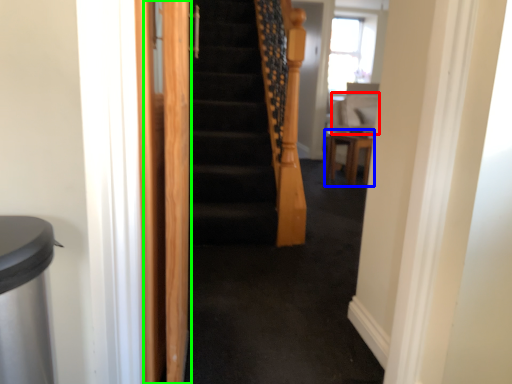
Question: Estimate the real-world distances between objects in this image. Which object is farther from sit (highlighted by a red box), furniture (highlighted by a blue box) or screen door (highlighted by a green box)?

Choices:
 (A) furniture
 (B) screen door

Answer: (B)